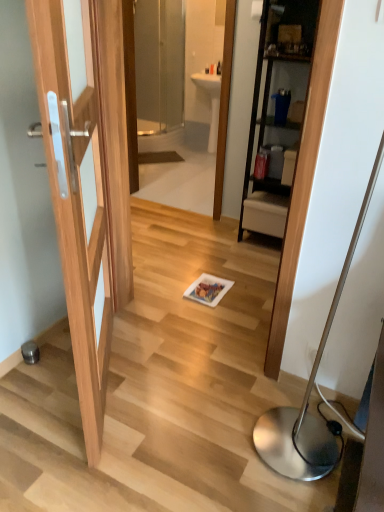
Locate an element on the screen. The image size is (384, 512). vacant region to the left of transparent glass mirror at upper center is located at coordinates [144, 206].